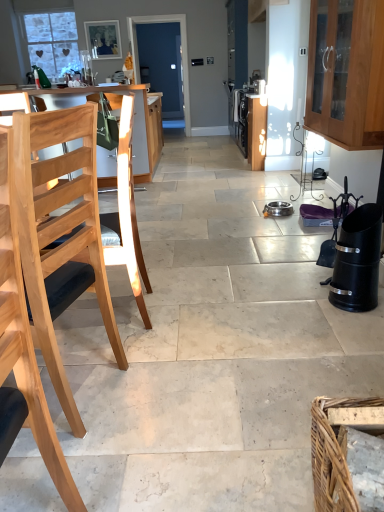
Locate an element on the screen. The width and height of the screenshot is (384, 512). vacant space to the right of natural wood chair at left is located at coordinates (159, 392).